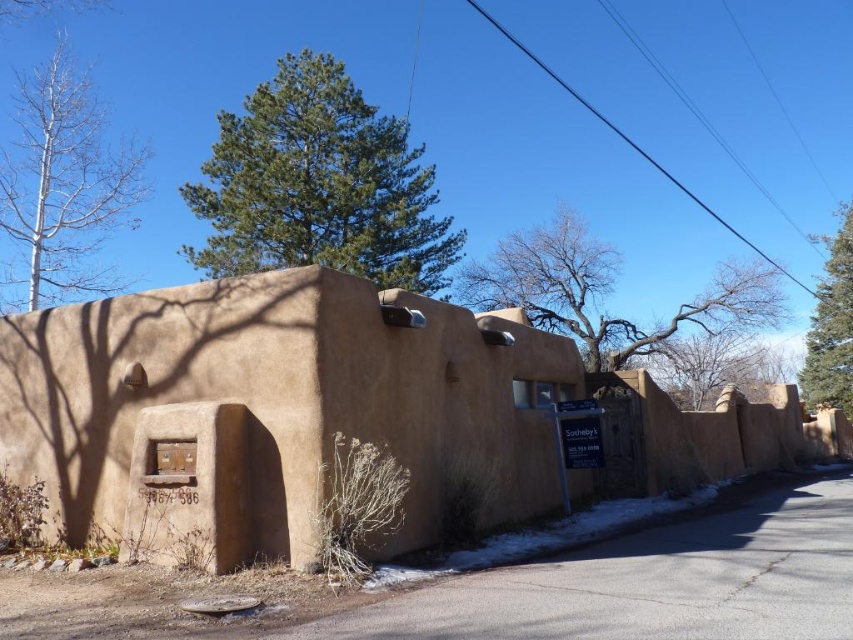
Based on the photo, you are standing in front of the rustic adobe building and notice a point marked at coordinates (608, 292). What is located at this point?

The point at coordinates (608, 292) indicates bare branches at upper center.

You are standing in front of the rustic adobe building and want to determine which of the two points, point (82, 125) or point (824, 348), is closer to you. Based on the scene, which point is nearer?

Point (82, 125) is closer to the viewer than point (824, 348).